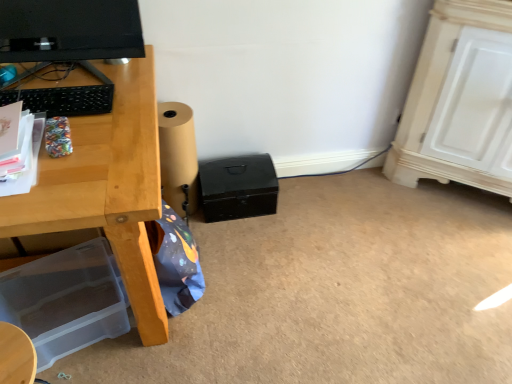
The image size is (512, 384). What are the coordinates of `empty space that is ontop of brown paper roll at lower center (from a real-world perspective)` in the screenshot? It's located at (170, 115).